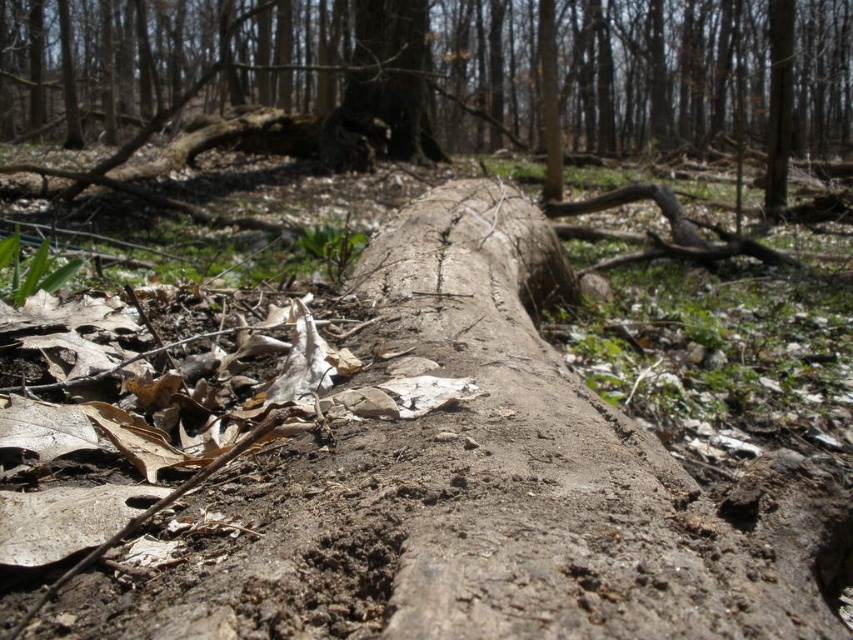
Looking at this image, is smooth bark log at center closer to the viewer compared to smooth brown log at center?

That is True.

Does smooth bark log at center appear over smooth brown log at center?

Correct, smooth bark log at center is located above smooth brown log at center.

Who is more distant from viewer, (618, 147) or (415, 131)?

Positioned behind is point (618, 147).

Where is `smooth bark log at center`? Image resolution: width=853 pixels, height=640 pixels. smooth bark log at center is located at coordinates (701, 72).